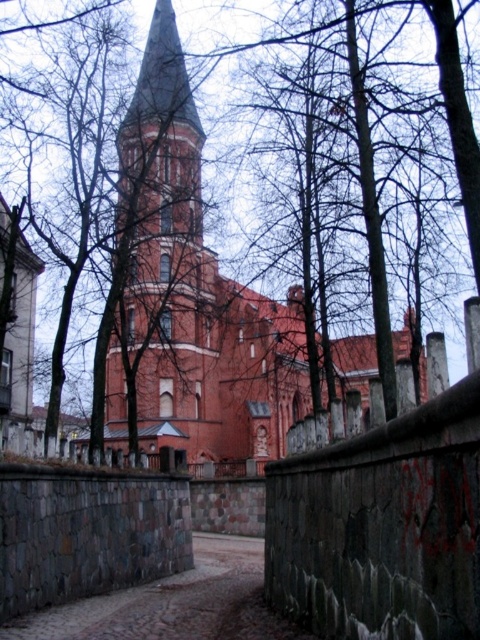
You are standing at the end of the cobblestone path leading to the red brick church at center. If you walk straight towards the church, how far will you have to walk to reach it?

You will have to walk 236.16 feet to reach the red brick church at center.

You are a tourist standing at the entrance of the cobblestone path leading to the red brick church at center. You notice the weathered stone wall at center in the background. Which structure is closer to you as you face the church?

The red brick church at center is closer to you than the weathered stone wall at center because the wall is positioned behind the church.

You are a tourist standing at the entrance of the cobblestone path leading to the historic site. You notice the red brick church at center and the weathered stone wall at center. Which structure appears bigger to you?

The red brick church at center is larger in size than the weathered stone wall at center, so the church appears bigger.